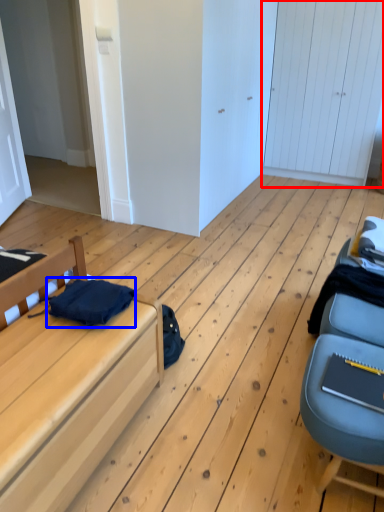
Question: Among these objects, which one is nearest to the camera, door (highlighted by a red box) or clothing (highlighted by a blue box)?

Choices:
 (A) door
 (B) clothing

Answer: (B)